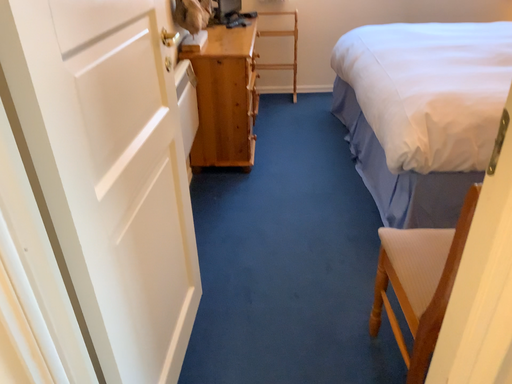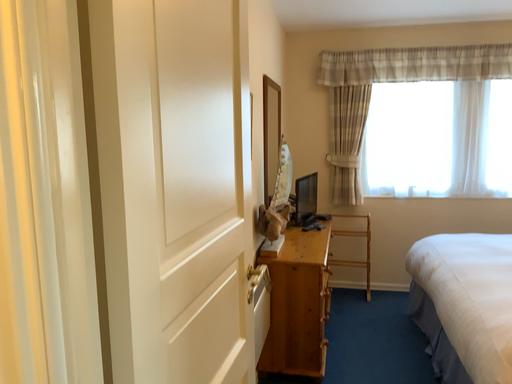
Question: Which way did the camera rotate in the video?

Choices:
 (A) rotated right
 (B) rotated left

Answer: (B)